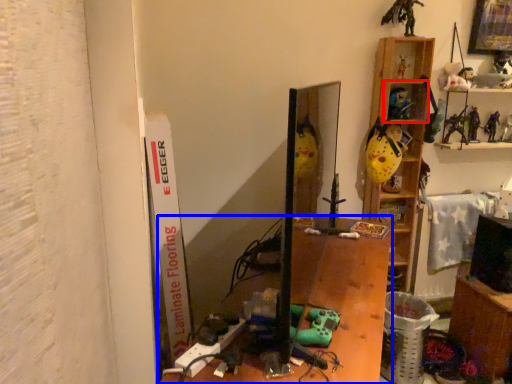
Question: Which of the following is the closest to the observer, shelf (highlighted by a red box) or furniture (highlighted by a blue box)?

Choices:
 (A) shelf
 (B) furniture

Answer: (B)